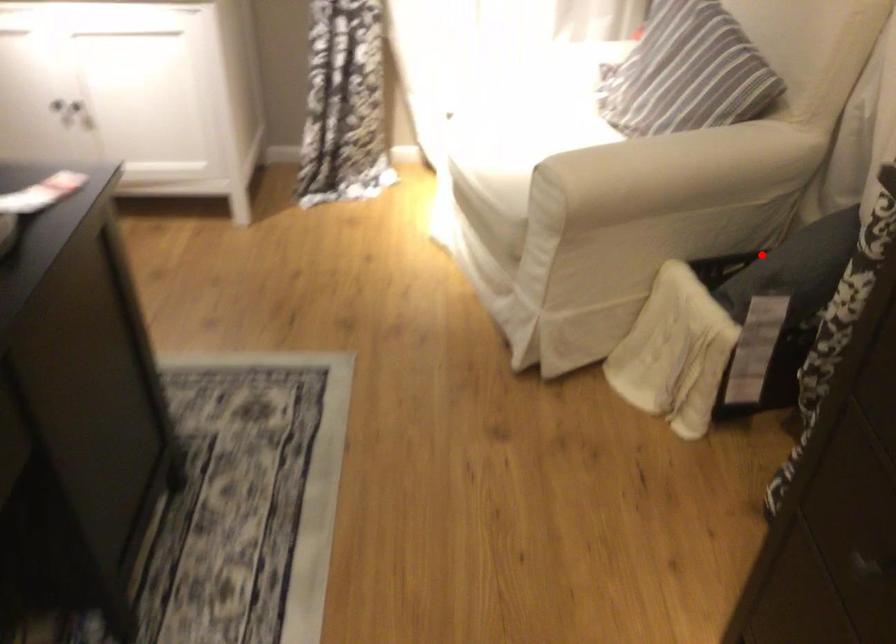
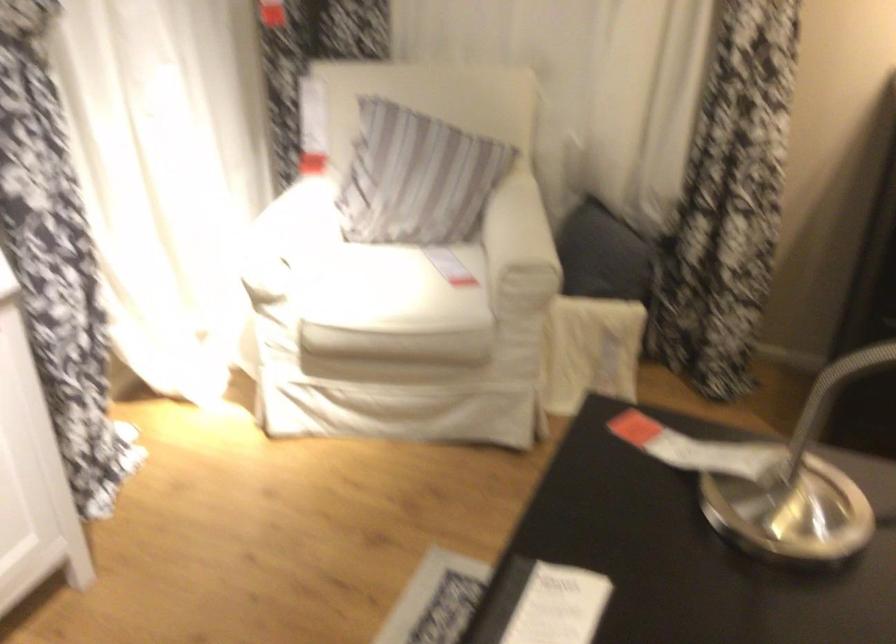
Question: I am providing you with two images of the same scene from different viewpoints. A red point is marked on the first image. Can you still see the location of the red point in image 2?

Choices:
 (A) Yes
 (B) No

Answer: (A)